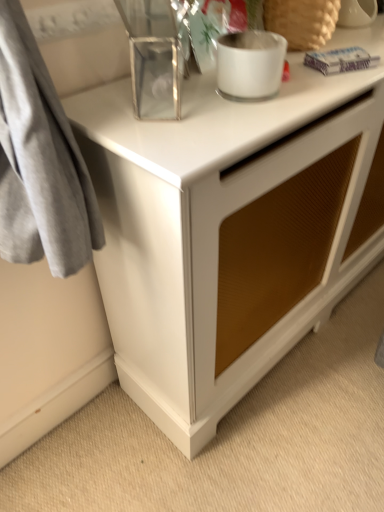
Question: Looking at their shapes, would you say frosted glass candle at upper center, which ranks as the second appliance in right-to-left order, is wider or thinner than white glossy cabinet at center?

Choices:
 (A) thin
 (B) wide

Answer: (A)

Question: Based on their sizes in the image, would you say frosted glass candle at upper center, the 2th appliance in the left-to-right sequence, is bigger or smaller than white glossy cabinet at center?

Choices:
 (A) big
 (B) small

Answer: (B)

Question: Which of these objects is positioned farthest from the white ceramic vase at upper right, which is the 1th appliance from right to left?

Choices:
 (A) white glossy cabinet at center
 (B) frosted glass candle at upper center, which ranks as the second appliance in right-to-left order
 (C) clear glass rectangular box at upper center, acting as the third appliance starting from the right

Answer: (A)

Question: Which object is the farthest from the white glossy cabinet at center?

Choices:
 (A) white ceramic vase at upper right, which is the 1th appliance from right to left
 (B) clear glass rectangular box at upper center, which ranks as the 1th appliance in left-to-right order
 (C) frosted glass candle at upper center, the 2th appliance in the left-to-right sequence

Answer: (A)